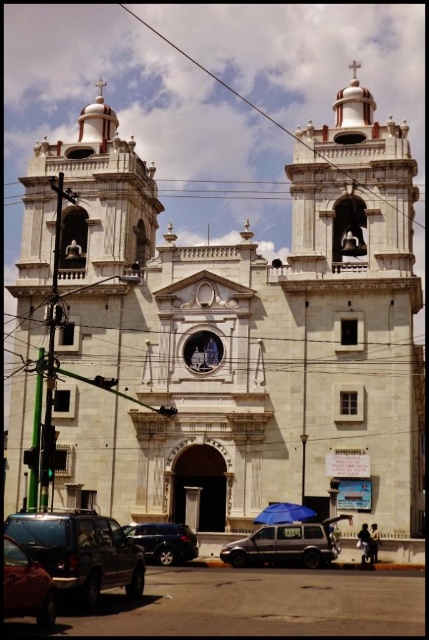
Can you confirm if metallic gray suv at lower left is wider than matte black van at center?

Correct, the width of metallic gray suv at lower left exceeds that of matte black van at center.

Between metallic gray suv at lower left and matte black van at center, which one is positioned lower?

matte black van at center is below.

Identify the location of metallic gray suv at lower left. (81, 552).

Can you confirm if matte black van at center is positioned to the right of satin black car at lower left?

Correct, you'll find matte black van at center to the right of satin black car at lower left.

Is the position of matte black van at center more distant than that of satin black car at lower left?

No.

This screenshot has height=640, width=429. Find the location of `matte black van at center`. matte black van at center is located at coordinates (283, 545).

Between metallic gray suv at lower left and shiny black car at lower left, which one is positioned lower?

metallic gray suv at lower left is below.

Can you confirm if metallic gray suv at lower left is bigger than shiny black car at lower left?

Indeed, metallic gray suv at lower left has a larger size compared to shiny black car at lower left.

Find the location of a particular element. metallic gray suv at lower left is located at coordinates (81, 552).